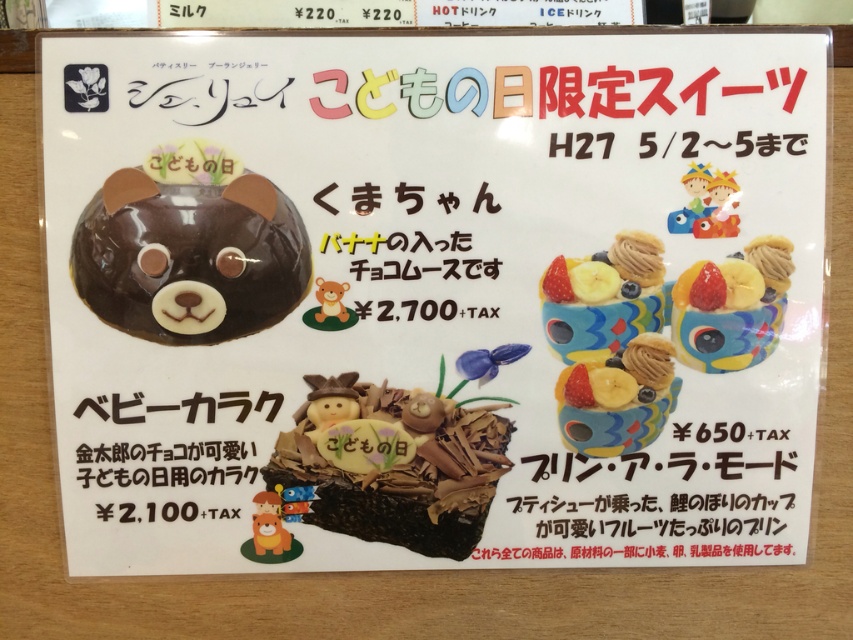
Question: Can you confirm if matte chocolate cake at center is positioned above matte plastic toy at upper right?

Choices:
 (A) no
 (B) yes

Answer: (A)

Question: Considering the real-world distances, which object is closest to the matte chocolate cake at center?

Choices:
 (A) matte plastic toy at upper right
 (B) chocolatesmoothbear face at upper left

Answer: (B)

Question: Can you confirm if chocolatesmoothbear face at upper left is smaller than matte chocolate cupcake at center right?

Choices:
 (A) yes
 (B) no

Answer: (B)

Question: Which of the following is the farthest from the observer?

Choices:
 (A) (691, 177)
 (B) (440, 515)
 (C) (651, 492)
 (D) (735, 262)

Answer: (B)

Question: Which point is closer to the camera taking this photo?

Choices:
 (A) (469, 378)
 (B) (561, 435)

Answer: (A)

Question: Does chocolatesmoothbear face at upper left appear under matte blue beads at center?

Choices:
 (A) yes
 (B) no

Answer: (B)